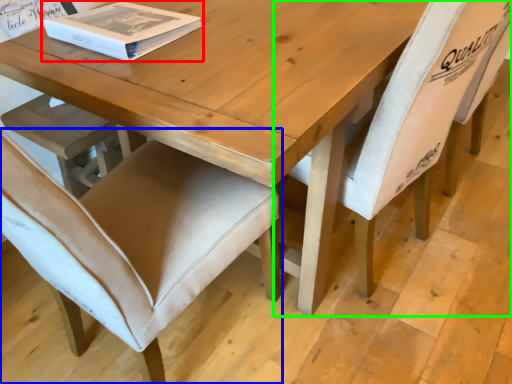
Question: Estimate the real-world distances between objects in this image. Which object is farther from box (highlighted by a red box), chair (highlighted by a blue box) or chair (highlighted by a green box)?

Choices:
 (A) chair
 (B) chair

Answer: (B)